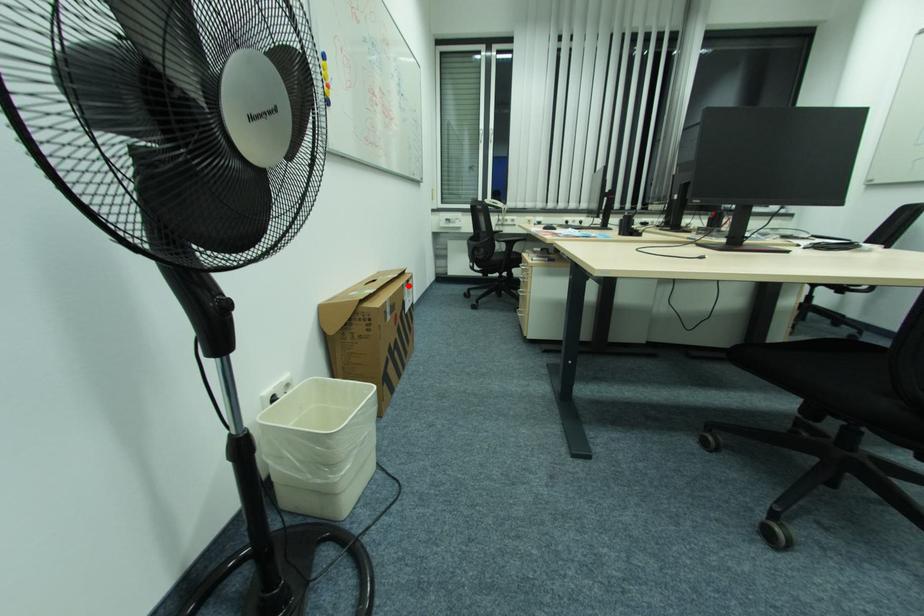
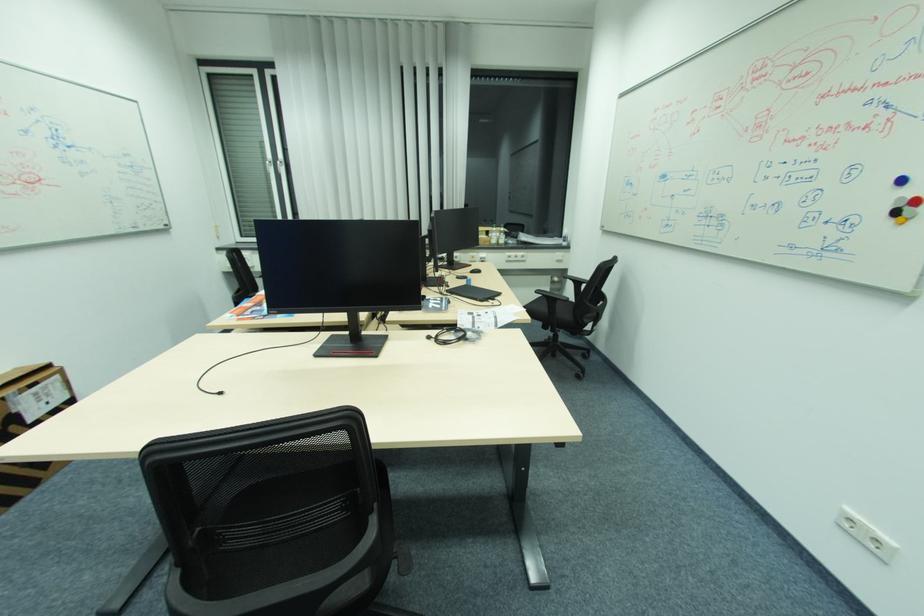
Find the pixel in the second image that matches the highlighted location in the first image.

(7, 399)